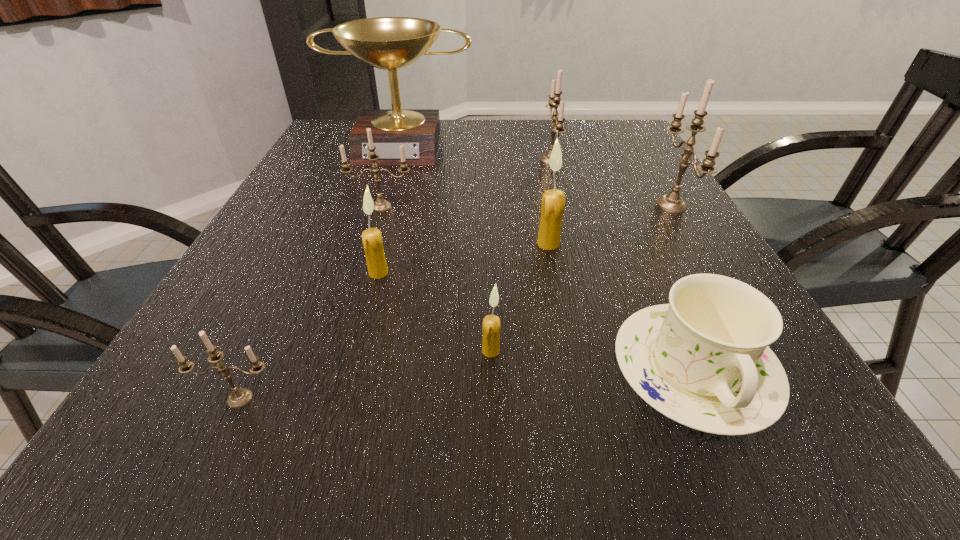
Locate which metallic candle ranks second in proximity to the farthest metallic candle. Please provide its 2D coordinates. Your answer should be formatted as a tuple, i.e. [(x, y)], where the tuple contains the x and y coordinates of a point satisfying the conditions above.

[(380, 205)]

Identify which metallic candle is the fourth nearest to the award. Please provide its 2D coordinates. Your answer should be formatted as a tuple, i.e. [(x, y)], where the tuple contains the x and y coordinates of a point satisfying the conditions above.

[(239, 397)]

Identify which cream candle is located as the second nearest to the nearest metallic candle. Please provide its 2D coordinates. Your answer should be formatted as a tuple, i.e. [(x, y)], where the tuple contains the x and y coordinates of a point satisfying the conditions above.

[(491, 323)]

At what (x,y) coordinates should I click in order to perform the action: click on the second closest cream candle relative to the tallest candle. Please return your answer as a coordinate pair (x, y). This screenshot has height=540, width=960. Looking at the image, I should click on (491, 323).

Where is `vacant space that satisfies the following two spatial constraints: 1. on the front side of the sixth farthest object; 2. on the right side of the third biggest metallic candle`? The image size is (960, 540). vacant space that satisfies the following two spatial constraints: 1. on the front side of the sixth farthest object; 2. on the right side of the third biggest metallic candle is located at coordinates click(361, 273).

Find the location of a particular element. The height and width of the screenshot is (540, 960). vacant position in the image that satisfies the following two spatial constraints: 1. on the front-facing side of the fifth nearest object; 2. on the left side of the award is located at coordinates (370, 244).

Where is `free space that satisfies the following two spatial constraints: 1. on the back side of the second smallest metallic candle; 2. on the right side of the biggest metallic candle`? free space that satisfies the following two spatial constraints: 1. on the back side of the second smallest metallic candle; 2. on the right side of the biggest metallic candle is located at coordinates (382, 205).

The height and width of the screenshot is (540, 960). Identify the location of vacant space that satisfies the following two spatial constraints: 1. on the front-facing side of the third nearest candle; 2. on the right side of the award. (360, 273).